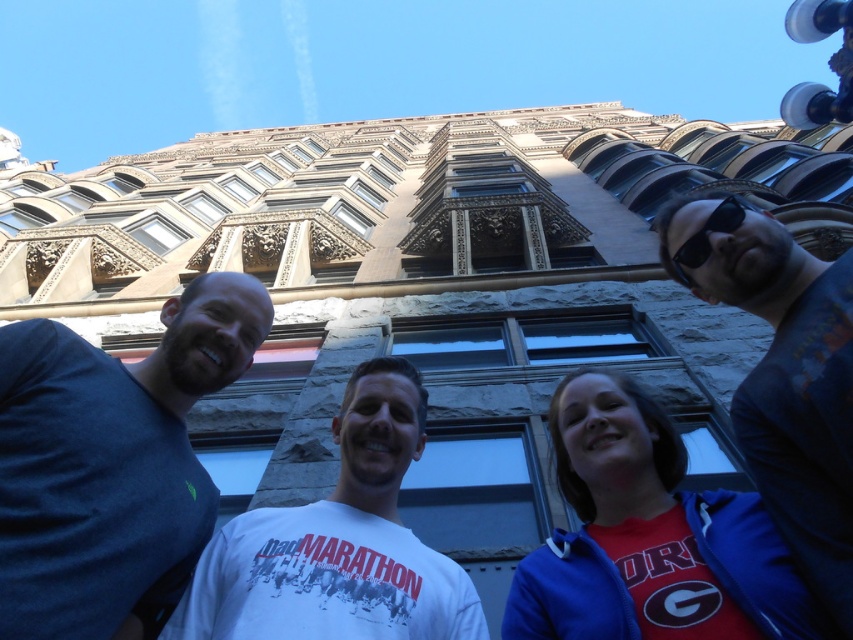
Is red matte jacket at lower right wider than black plastic sunglasses at upper right?

Correct, the width of red matte jacket at lower right exceeds that of black plastic sunglasses at upper right.

Is red matte jacket at lower right thinner than black plastic sunglasses at upper right?

Incorrect, red matte jacket at lower right's width is not less than black plastic sunglasses at upper right's.

The height and width of the screenshot is (640, 853). What do you see at coordinates (648, 536) in the screenshot?
I see `red matte jacket at lower right` at bounding box center [648, 536].

Where is `red matte jacket at lower right`? Image resolution: width=853 pixels, height=640 pixels. red matte jacket at lower right is located at coordinates (648, 536).

Who is more forward, [764,403] or [669,220]?

Positioned in front is point [764,403].

Which is above, dark blue t-shirt at right or black plastic sunglasses at upper right?

black plastic sunglasses at upper right is higher up.

Is point (840, 556) closer to viewer compared to point (679, 259)?

That is True.

Identify the location of dark blue t-shirt at right. (782, 372).

Which of these two, red matte jacket at lower right or dark blue t-shirt at right, stands shorter?

red matte jacket at lower right

Image resolution: width=853 pixels, height=640 pixels. Identify the location of red matte jacket at lower right. (648, 536).